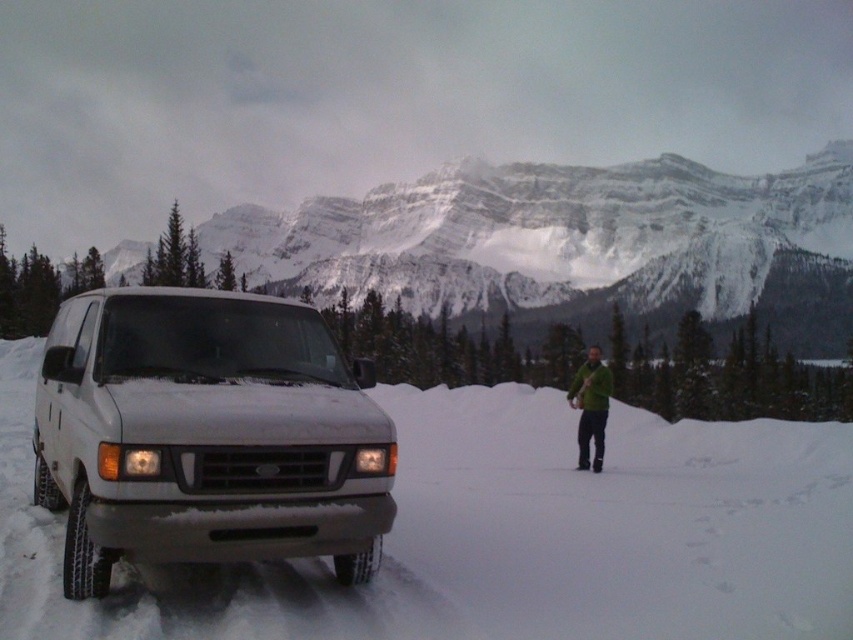
You are a hiker planning to take a photo of the snowy granite mountain at upper center and the white matte suv at left. From your current position, which object should you aim your camera towards first to capture both in one shot?

The snowy granite mountain at upper center is to the right of the white matte suv at left, so you should aim your camera towards the white matte suv at left first to ensure both objects are included in the frame.

You are planning to take a photo of the snowy granite mountain at upper center and the white matte suv at left. Which object should you focus on first if you want to capture both in the same frame without moving the camera?

The snowy granite mountain at upper center is wider than the white matte suv at left, so you should focus on the snowy granite mountain at upper center first to ensure it fits within the frame.

You are a hiker planning to take a photo of the snowy granite mountain at upper center and the white matte suv at left. Which object should you focus on first if you want to capture both in a single frame without moving the camera?

You should focus on the snowy granite mountain at upper center first because it is positioned over the white matte suv at left, meaning it is closer to the camera. By focusing on the closer object first, you can ensure both are in focus within the depth of field.